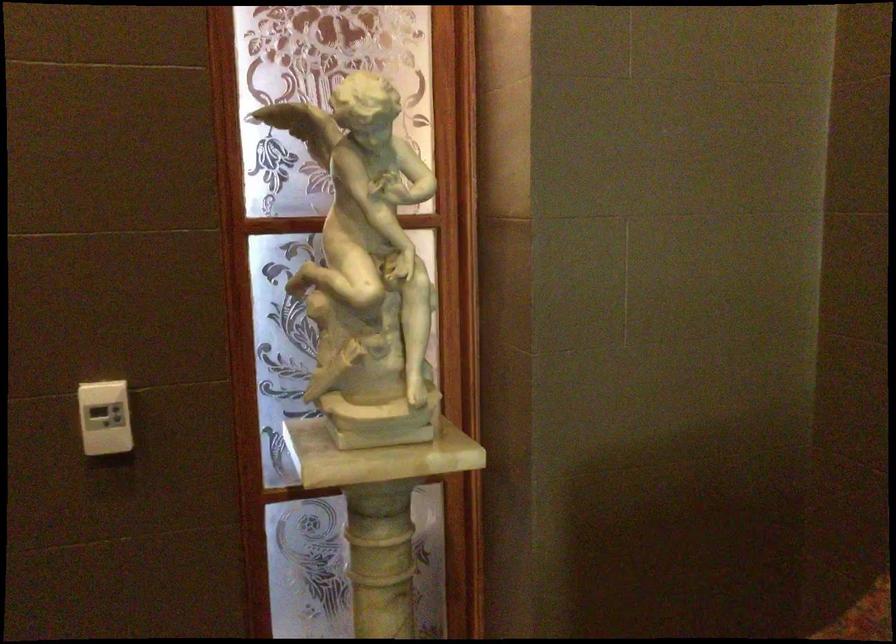
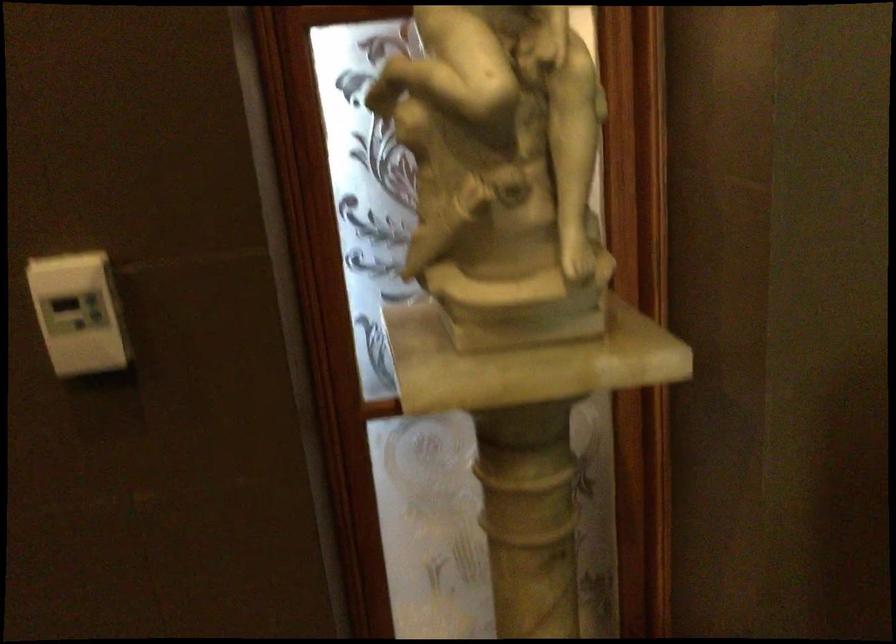
In the second image, find the point that corresponds to (x=371, y=337) in the first image.

(502, 172)